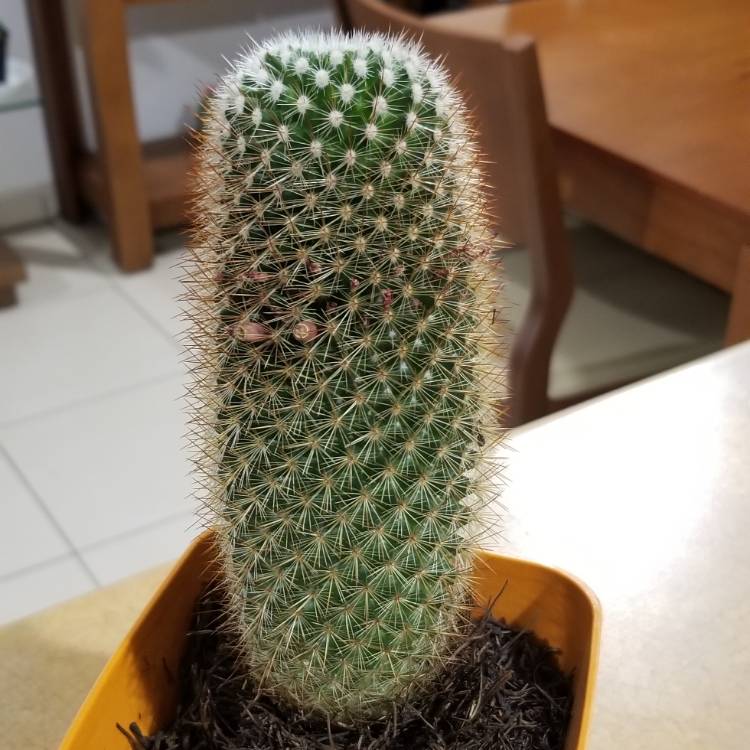
Locate an element on the screen. wall is located at coordinates (178, 54), (16, 18), (79, 54).